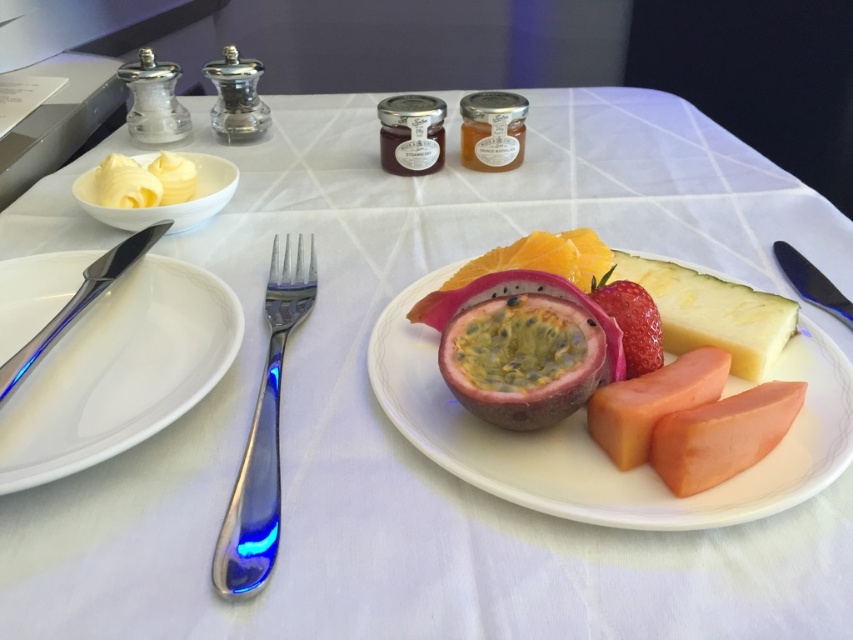
Does yellow butter at upper left have a greater width compared to silvermetallicknife at right?

Yes.

Between yellow butter at upper left and silvermetallicknife at right, which one has less height?

With less height is yellow butter at upper left.

Which is behind, point (167, 198) or point (788, 257)?

The point (167, 198) is more distant.

Image resolution: width=853 pixels, height=640 pixels. In order to click on yellow butter at upper left in this screenshot , I will do `click(144, 180)`.

How far apart are white matte butter at upper left and silvermetallicknife at right?

white matte butter at upper left is 17.12 inches away from silvermetallicknife at right.

Can you confirm if white matte butter at upper left is positioned to the right of silvermetallicknife at right?

Incorrect, white matte butter at upper left is not on the right side of silvermetallicknife at right.

The height and width of the screenshot is (640, 853). Identify the location of white matte butter at upper left. (167, 204).

Image resolution: width=853 pixels, height=640 pixels. Identify the location of white matte butter at upper left. (167, 204).

Is point (762, 406) positioned in front of point (134, 198)?

Yes, point (762, 406) is closer to viewer.

From the picture: Does orange fleshed at center have a smaller size compared to yellow butter at upper left?

Indeed, orange fleshed at center has a smaller size compared to yellow butter at upper left.

Identify the location of orange fleshed at center. (722, 435).

Locate an element on the screen. orange fleshed at center is located at coordinates (722, 435).